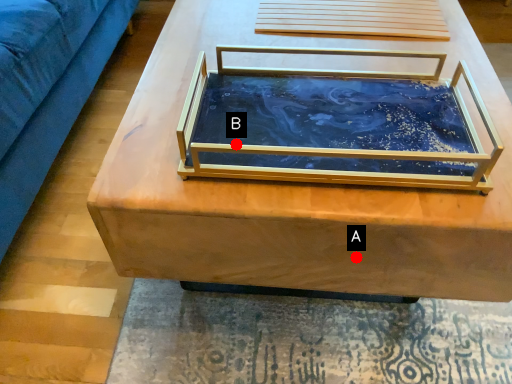
Question: Two points are circled on the image, labeled by A and B beside each circle. Which point is farther from the camera taking this photo?

Choices:
 (A) A is further
 (B) B is further

Answer: (B)